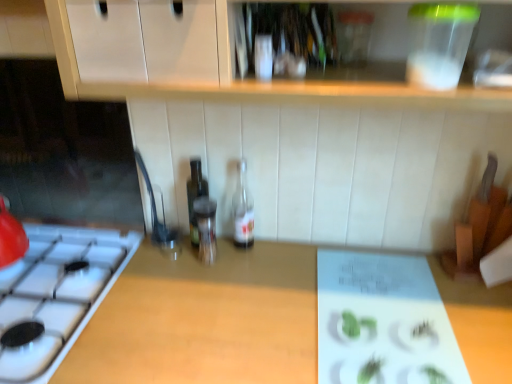
Question: In terms of size, does clear glass bottle at center, the first bottle positioned from the right, appear bigger or smaller than wooden at center?

Choices:
 (A) small
 (B) big

Answer: (A)

Question: In the image, is clear glass bottle at center, the first bottle positioned from the right, positioned in front of or behind wooden at center?

Choices:
 (A) behind
 (B) front

Answer: (A)

Question: Which is farther from the transparent glass bottle at center, which is the 2th bottle from left to right?

Choices:
 (A) clear glass bottle at center, acting as the 3th bottle starting from the left
 (B) translucent glass bottle at center, arranged as the 1th bottle when viewed from the left
 (C) wooden at center

Answer: (C)

Question: Which of these objects is positioned farthest from the wooden at center?

Choices:
 (A) translucent glass bottle at center, the third bottle in the right-to-left sequence
 (B) clear glass bottle at center, acting as the 3th bottle starting from the left
 (C) transparent glass bottle at center, which is the 2th bottle from left to right

Answer: (B)